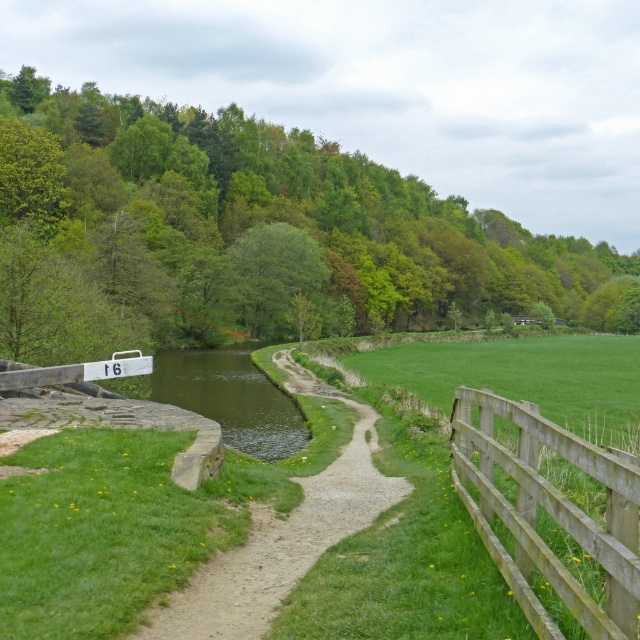
Find the location of a particular element. This screenshot has height=640, width=640. wooden fence at right is located at coordinates pos(550,513).

Can you confirm if wooden fence at right is bigger than dirt path at center?

No.

Who is more distant from viewer, (518, 596) or (353, 502)?

Point (353, 502)

This screenshot has width=640, height=640. In order to click on wooden fence at right in this screenshot , I will do `click(550, 513)`.

Measure the distance between green leafy tree at upper center and camera.

A distance of 23.06 meters exists between green leafy tree at upper center and camera.

Which is more to the left, green leafy tree at upper center or dirt path at center?

dirt path at center

Does point (195, 317) come in front of point (317, 554)?

No, (195, 317) is further to viewer.

Find the location of a particular element. The width and height of the screenshot is (640, 640). green leafy tree at upper center is located at coordinates (237, 230).

Who is lower down, green leafy tree at upper center or wooden fence at right?

wooden fence at right is below.

Between green leafy tree at upper center and wooden fence at right, which one has less height?

Standing shorter between the two is wooden fence at right.

Is point (116, 202) positioned after point (627, 536)?

Yes, point (116, 202) is behind point (627, 536).

You are a GUI agent. You are given a task and a screenshot of the screen. Output one action in this format:
    pyautogui.click(x=<x>, y=<y>)
    Task: Click on the green leafy tree at upper center
    
    Given the screenshot: What is the action you would take?
    pyautogui.click(x=237, y=230)